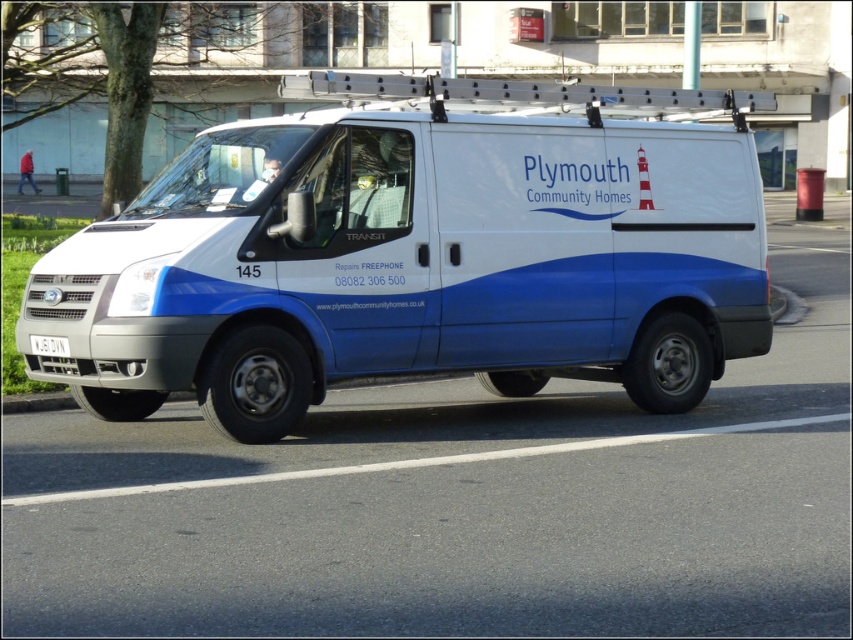
You are a delivery driver who needs to park your white matte van at center in a parking spot that can only accommodate vehicles up to the size of the white plastic license plate at center. Can your van fit in the parking spot?

The white matte van at center is larger than the white plastic license plate at center, so it cannot fit in the parking spot designed for smaller vehicles.